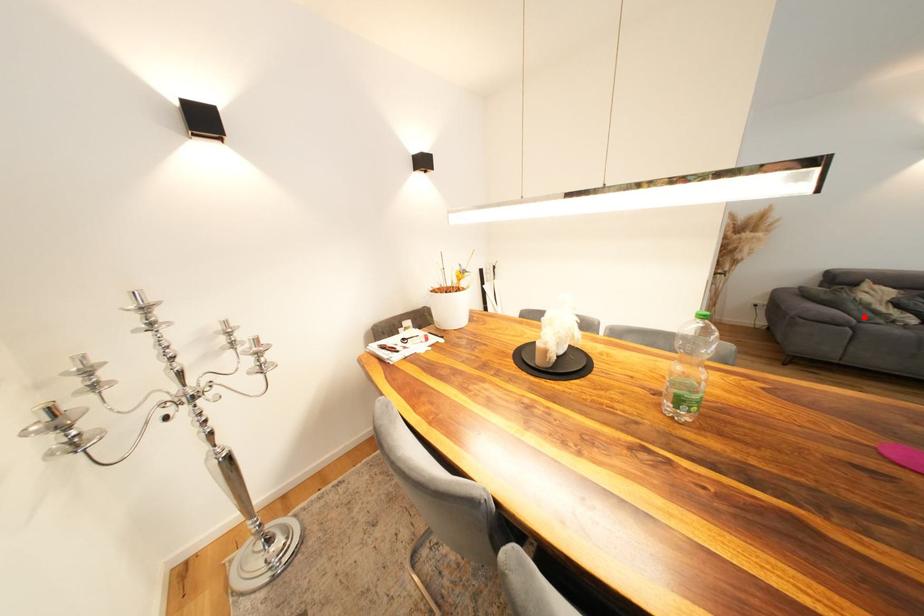
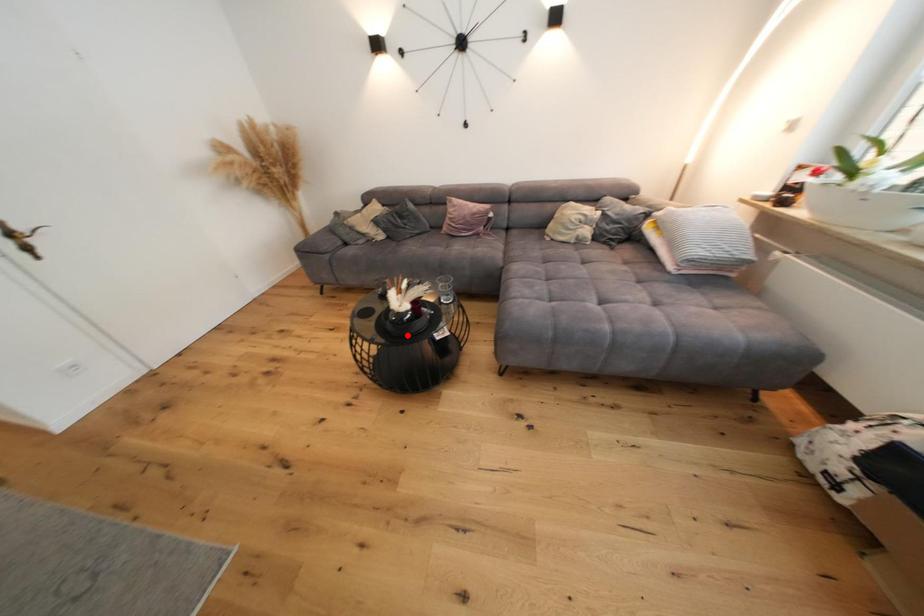
I am providing you with two images of the same scene from different viewpoints. A red point is marked on the first image and another point is marked on the second image. Are the points marked in image1 and image2 representing the same 3D position?

No